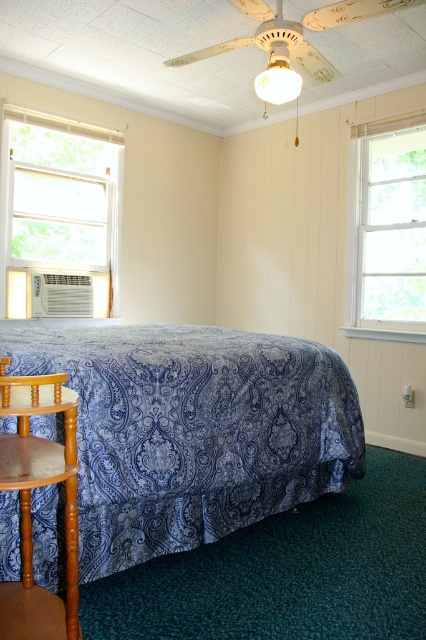
You are standing in the bedroom and want to place a 5 feet long sofa between the white fabric window at left and the wooden armchair at lower left. Is there enough space?

The distance between the white fabric window at left and the wooden armchair at lower left is 8.77 feet, which is more than enough to place a 5 feet long sofa between them.

You are standing in the bedroom and want to know which object is wider between the white fabric window at left and the wooden armchair at lower left. Can you determine which one is wider?

The white fabric window at left is wider than the wooden armchair at lower left according to the description.

You are standing in the bedroom and want to reach both the white fabric window at left and the matte white bulb at upper center. Which object is closer to you?

The white fabric window at left is closer to you than the matte white bulb at upper center because it is only 6.39 feet away from the bulb, but since the bulb is at upper center, the window is likely closer in your line of sight.